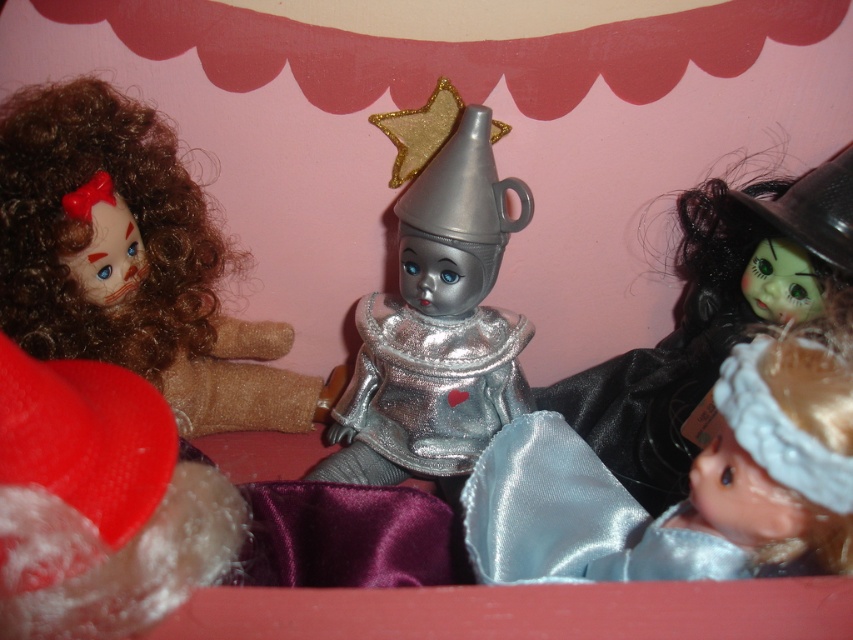
You are standing in front of the dolls and want to pick up the matte brown doll at left and the satin blue dress at lower right. Which one is higher up?

The matte brown doll at left is located above the satin blue dress at lower right, so it is higher up.

You are a photographer trying to capture a photo of the matte brown doll at left and the metallic silver tin at center. If you want to ensure both are in focus, which object should you focus on first to account for their sizes?

The matte brown doll at left is shorter than the metallic silver tin at center. Since the tin is taller, focusing on it first would help ensure both are in focus as the depth of field might extend better from a larger subject.